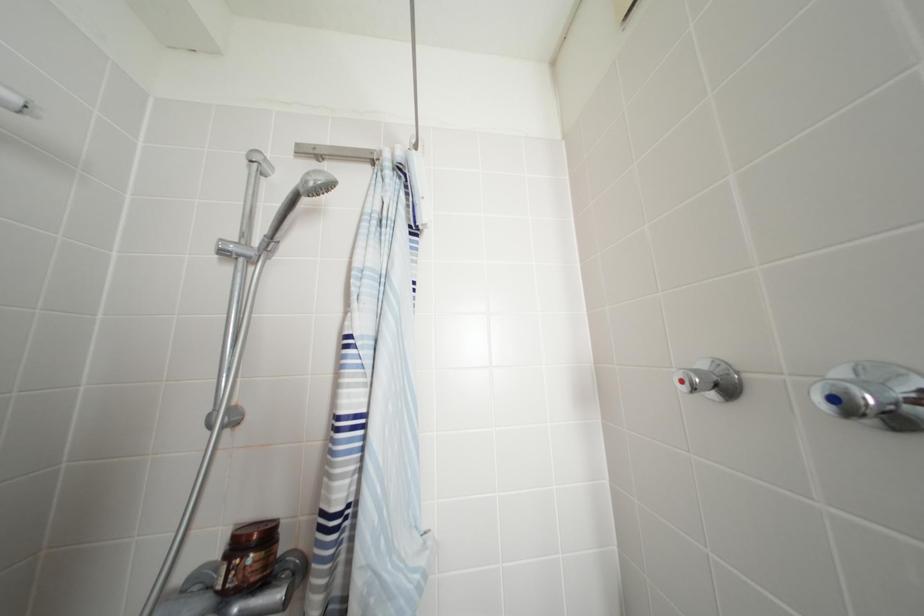
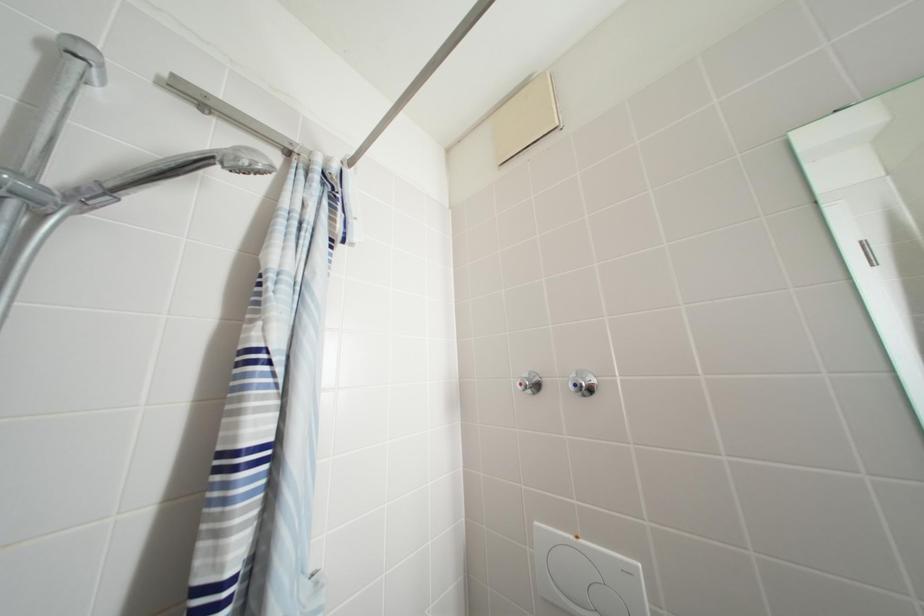
Question: Based on the continuous images, in which direction is the camera rotating? Reply with the corresponding letter.

Choices:
 (A) Left
 (B) Right
 (C) Up
 (D) Down

Answer: (B)